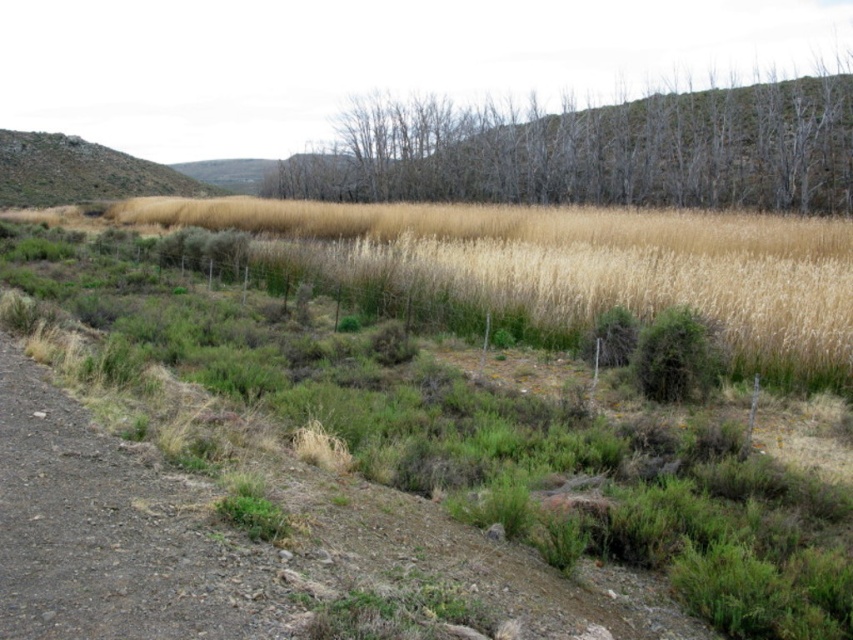
Who is more distant from viewer, [234,435] or [683,156]?

Point [683,156]

Does point (798, 458) come behind point (596, 144)?

That is False.

This screenshot has height=640, width=853. In order to click on dry grass at center in this screenshot , I will do `click(442, 449)`.

Who is taller, bare wood trees at center or rugged brown hillside at upper left?

rugged brown hillside at upper left is taller.

Locate an element on the screen. The height and width of the screenshot is (640, 853). bare wood trees at center is located at coordinates (x=599, y=152).

This screenshot has width=853, height=640. I want to click on bare wood trees at center, so click(599, 152).

You are a GUI agent. You are given a task and a screenshot of the screen. Output one action in this format:
    pyautogui.click(x=<x>, y=<y>)
    Task: Click on the dry grass at center
    
    Given the screenshot: What is the action you would take?
    pyautogui.click(x=442, y=449)

Which is below, dry grass at center or rugged brown hillside at upper left?

dry grass at center is below.

At what (x,y) coordinates should I click in order to perform the action: click on dry grass at center. Please return your answer as a coordinate pair (x, y). The image size is (853, 640). Looking at the image, I should click on (442, 449).